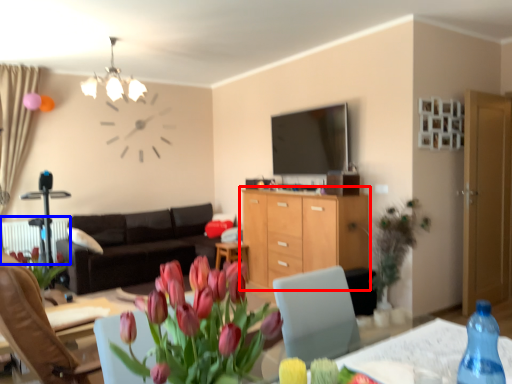
Question: Among these objects, which one is farthest to the camera, cabinetry (highlighted by a red box) or radiator (highlighted by a blue box)?

Choices:
 (A) cabinetry
 (B) radiator

Answer: (B)